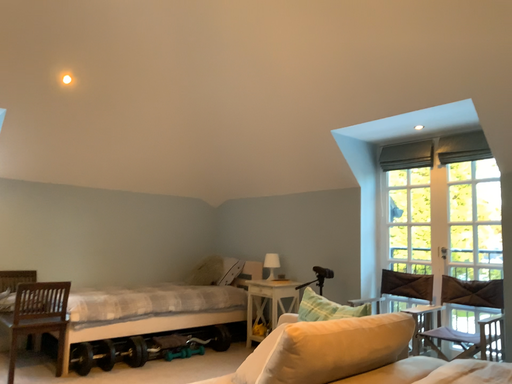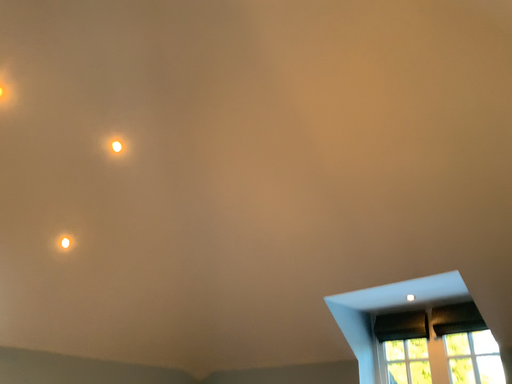
Question: Which way did the camera rotate in the video?

Choices:
 (A) rotated upward
 (B) rotated downward

Answer: (A)